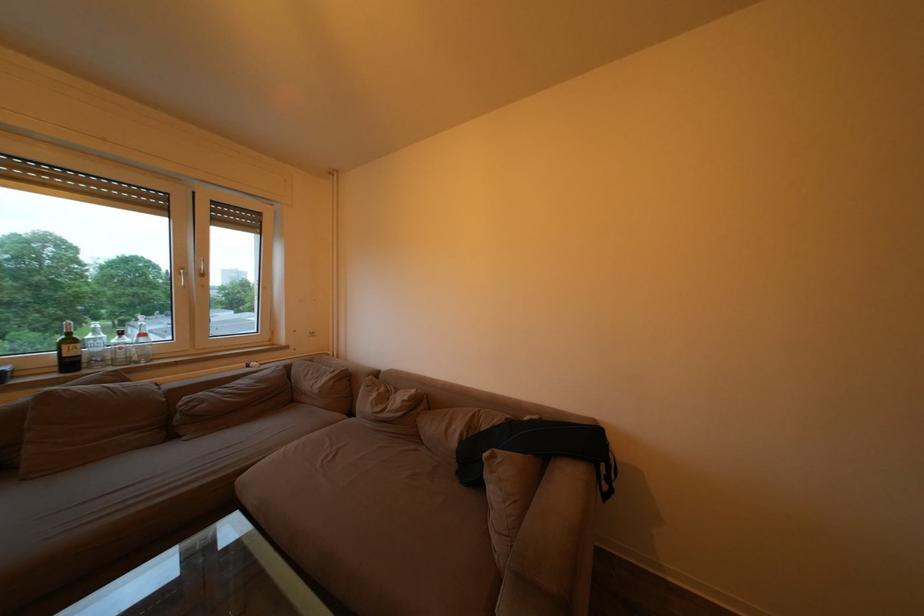
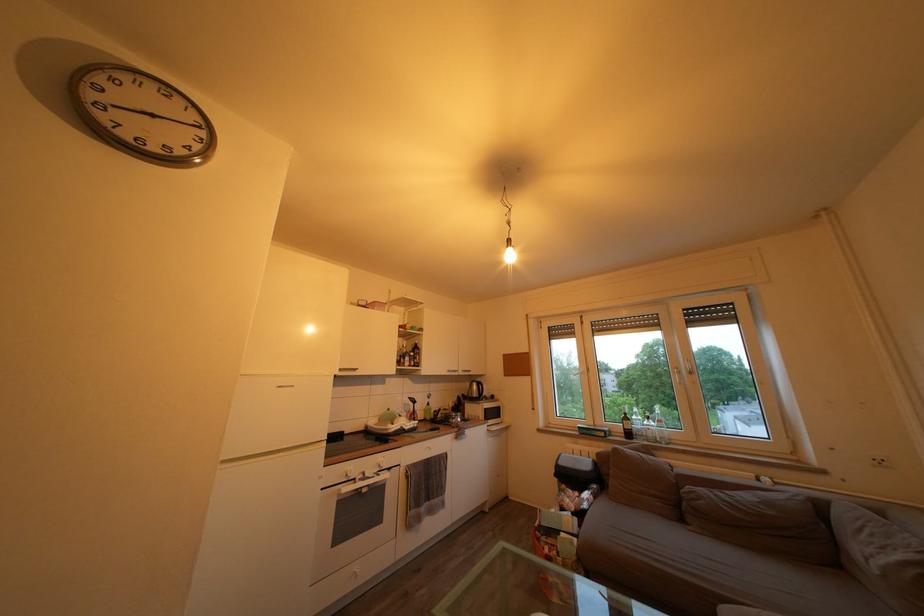
Where in the second image is the point corresponding to (x=79, y=347) from the first image?

(635, 424)